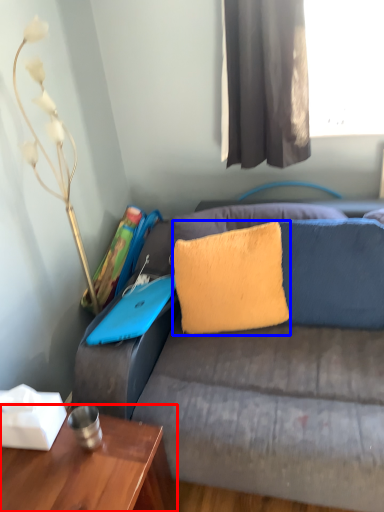
Question: Which object appears farthest to the camera in this image, table (highlighted by a red box) or pillow (highlighted by a blue box)?

Choices:
 (A) table
 (B) pillow

Answer: (B)